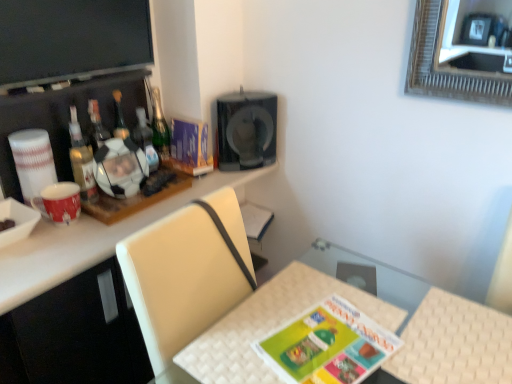
The height and width of the screenshot is (384, 512). I want to click on spots to the right of white matte bowl at left, so click(52, 249).